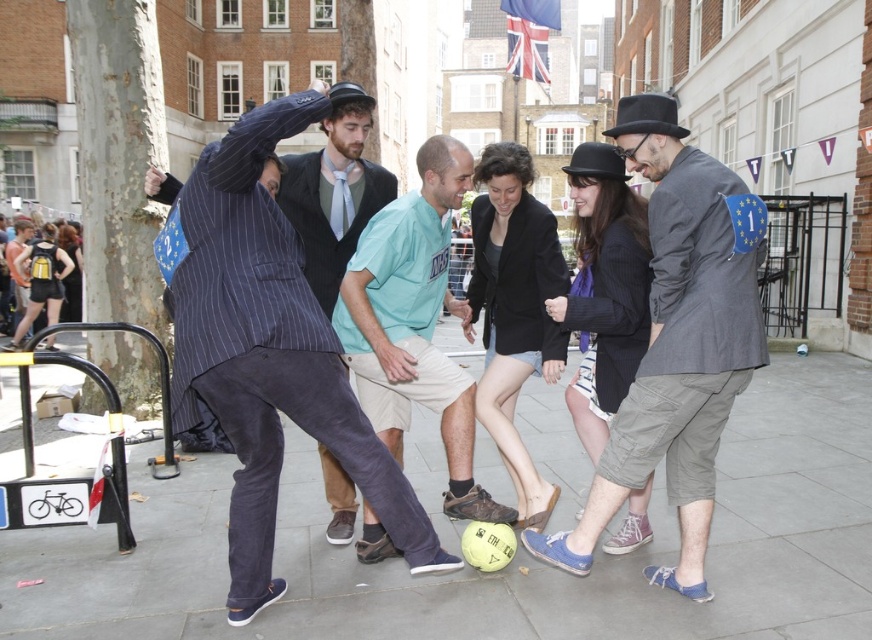
Question: Which point appears farthest from the camera in this image?

Choices:
 (A) (542, 545)
 (B) (240, 152)

Answer: (A)

Question: Which of the following is the closest to the observer?

Choices:
 (A) (761, 381)
 (B) (249, 212)

Answer: (B)

Question: Based on their relative distances, which object is farther from the light blue cotton shirt at center?

Choices:
 (A) gray cotton jacket at center
 (B) striped fabric suit at left
 (C) smooth concrete pavement at center

Answer: (C)

Question: Does striped fabric suit at left appear under light blue cotton shirt at center?

Choices:
 (A) no
 (B) yes

Answer: (B)

Question: Can you confirm if smooth concrete pavement at center is positioned to the right of gray cotton jacket at center?

Choices:
 (A) yes
 (B) no

Answer: (B)

Question: Is gray cotton jacket at center below light blue cotton shirt at center?

Choices:
 (A) no
 (B) yes

Answer: (B)